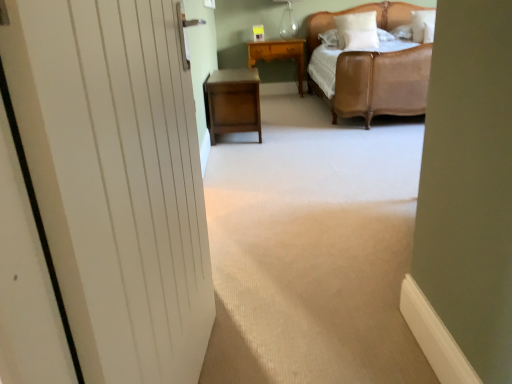
Question: Is there a large distance between white soft pillow at upper right, which is the first pillow in right-to-left order, and white matte door at left?

Choices:
 (A) no
 (B) yes

Answer: (B)

Question: Is white soft pillow at upper right, the third pillow from the left, facing away from white matte door at left?

Choices:
 (A) no
 (B) yes

Answer: (A)

Question: Does white soft pillow at upper right, the third pillow from the left, lie behind white matte door at left?

Choices:
 (A) yes
 (B) no

Answer: (A)

Question: Is white soft pillow at upper right, which is the first pillow in right-to-left order, bigger than white matte door at left?

Choices:
 (A) yes
 (B) no

Answer: (B)

Question: Considering the relative sizes of white soft pillow at upper right, which is the first pillow in right-to-left order, and white matte door at left in the image provided, is white soft pillow at upper right, which is the first pillow in right-to-left order, smaller than white matte door at left?

Choices:
 (A) no
 (B) yes

Answer: (B)

Question: Based on their sizes in the image, would you say wooden nightstand at center, positioned as the first nightstand in bottom-to-top order, is bigger or smaller than yellow wood nightstand at center, the 1th nightstand positioned from the top?

Choices:
 (A) small
 (B) big

Answer: (B)

Question: From their relative heights in the image, would you say wooden nightstand at center, the 2th nightstand positioned from the top, is taller or shorter than yellow wood nightstand at center, positioned as the 2th nightstand in bottom-to-top order?

Choices:
 (A) short
 (B) tall

Answer: (A)

Question: Considering the positions of point (215, 72) and point (262, 52), is point (215, 72) closer or farther from the camera than point (262, 52)?

Choices:
 (A) farther
 (B) closer

Answer: (B)

Question: In the image, is wooden nightstand at center, positioned as the first nightstand in bottom-to-top order, on the left side or the right side of yellow wood nightstand at center, arranged as the first nightstand when viewed from the back?

Choices:
 (A) right
 (B) left

Answer: (B)

Question: Considering the positions of point (125, 221) and point (364, 337), is point (125, 221) closer or farther from the camera than point (364, 337)?

Choices:
 (A) closer
 (B) farther

Answer: (A)

Question: From the image's perspective, is white matte door at left located above or below white wood door at left?

Choices:
 (A) above
 (B) below

Answer: (B)

Question: Based on their positions, is white matte door at left located to the left or right of white wood door at left?

Choices:
 (A) right
 (B) left

Answer: (B)

Question: From their relative heights in the image, would you say white matte door at left is taller or shorter than white wood door at left?

Choices:
 (A) tall
 (B) short

Answer: (A)

Question: Looking at their shapes, would you say white matte door at left is wider or thinner than white soft pillow at upper right, marked as the 1th pillow in a left-to-right arrangement?

Choices:
 (A) thin
 (B) wide

Answer: (A)

Question: Visually, is white matte door at left positioned to the left or to the right of white soft pillow at upper right, positioned as the third pillow in right-to-left order?

Choices:
 (A) left
 (B) right

Answer: (A)